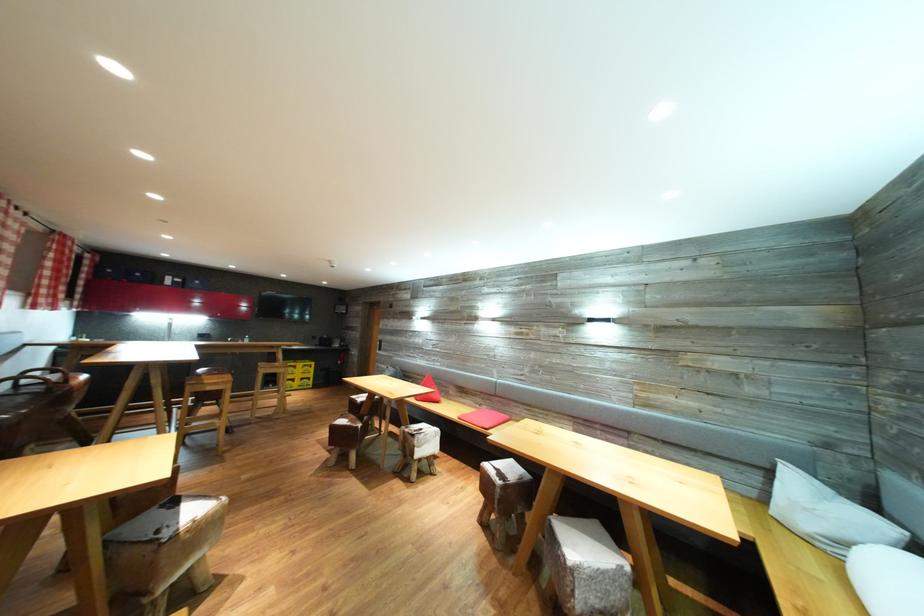
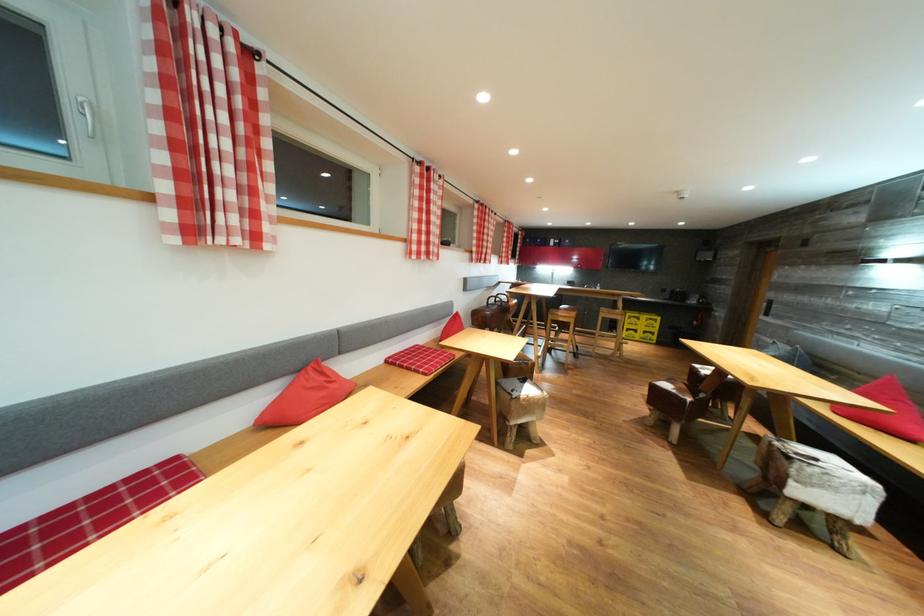
Find the pixel in the second image that matches [359,422] in the first image.

(689, 392)